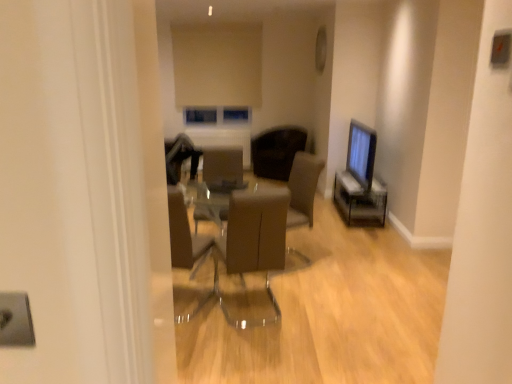
What are the coordinates of `vacant space in front of brown leather chair at center, the second chair viewed from the back` in the screenshot? It's located at (255, 350).